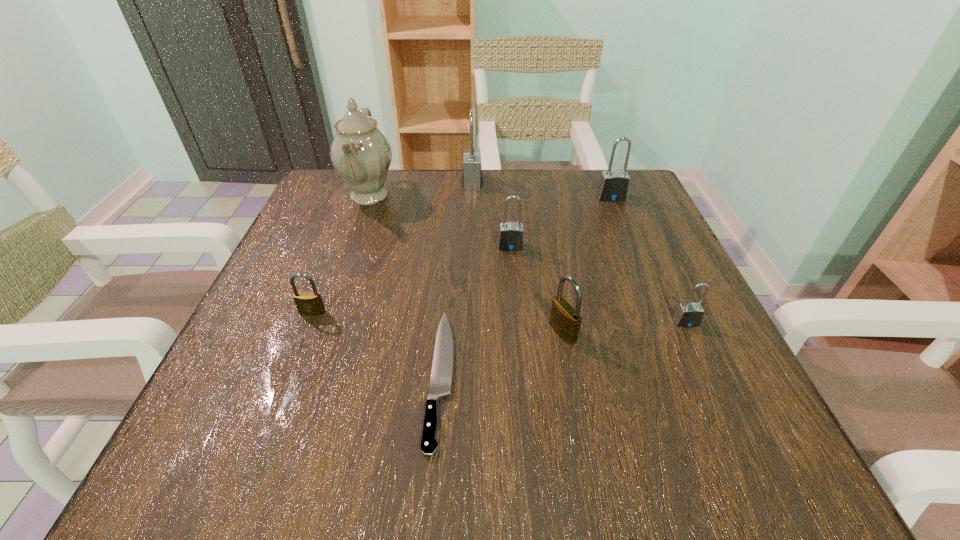
Identify the location of free space at the far left corner of the desktop. The image size is (960, 540). (311, 213).

In the image, there is a desktop. At what (x,y) coordinates should I click in order to perform the action: click on free space at the near left corner. Please return your answer as a coordinate pair (x, y). Looking at the image, I should click on (287, 448).

In order to click on free space at the far right corner in this screenshot , I will do `click(588, 184)`.

This screenshot has width=960, height=540. In the image, there is a desktop. In order to click on vacant space at the near right corner in this screenshot , I will do `click(738, 472)`.

You are a GUI agent. You are given a task and a screenshot of the screen. Output one action in this format:
    pyautogui.click(x=<x>, y=<y>)
    Task: Click on the vacant area that lies between the fifth object from left to right and the sixth shortest object
    This screenshot has width=960, height=540.
    Given the screenshot: What is the action you would take?
    pyautogui.click(x=561, y=221)

Identify the location of empty space that is in between the third biggest gray padlock and the tallest object. (440, 221).

Where is `free space between the steak knife and the second tallest object`? The width and height of the screenshot is (960, 540). free space between the steak knife and the second tallest object is located at coordinates (457, 279).

Locate an element on the screen. The image size is (960, 540). vacant space that's between the farther brass padlock and the nearest gray padlock is located at coordinates (499, 317).

Where is `vacant area that lies between the fifth shortest padlock and the farthest gray padlock`? The width and height of the screenshot is (960, 540). vacant area that lies between the fifth shortest padlock and the farthest gray padlock is located at coordinates (541, 190).

I want to click on vacant area that lies between the tallest object and the third nearest padlock, so click(341, 254).